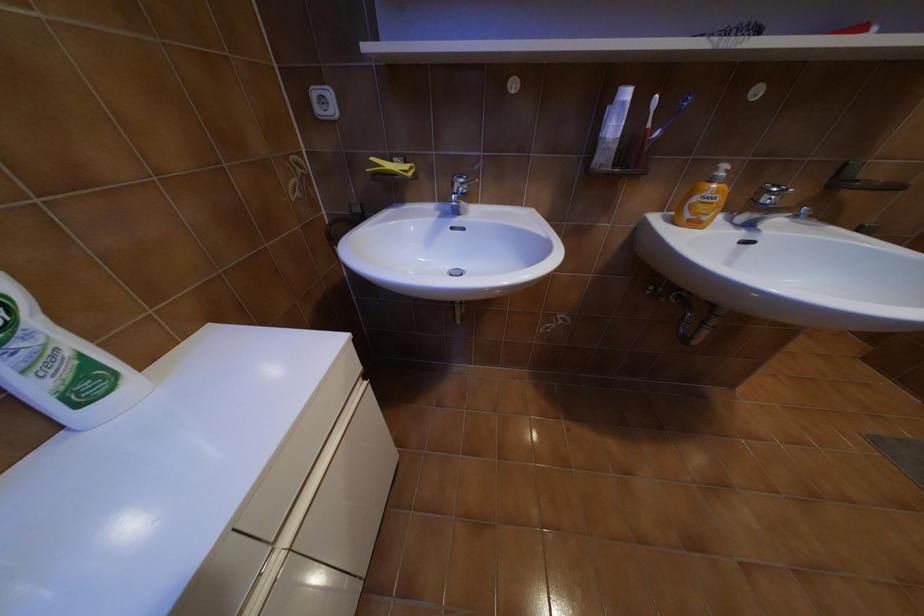
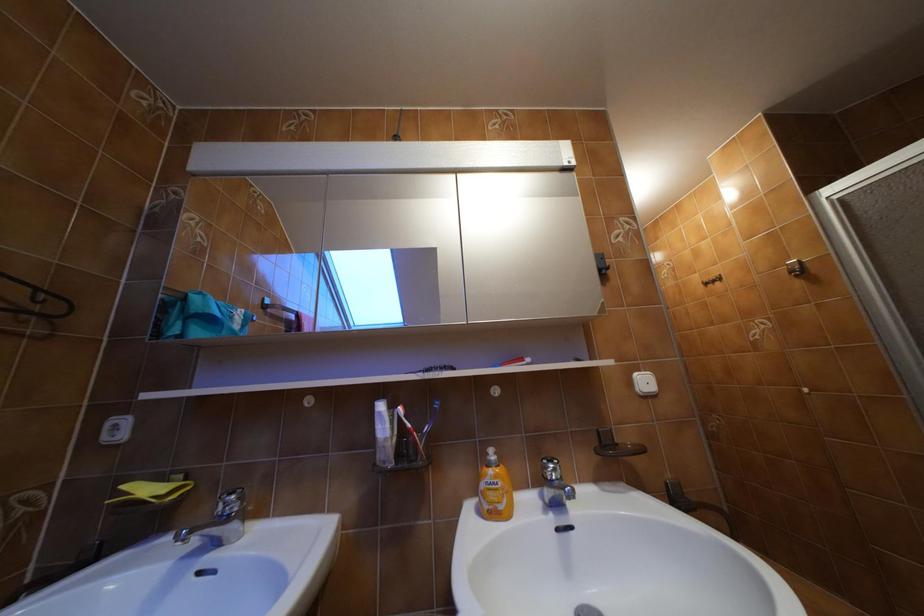
The first image is from the beginning of the video and the second image is from the end. How did the camera likely rotate when shooting the video?

The camera's rotation is toward right-up.